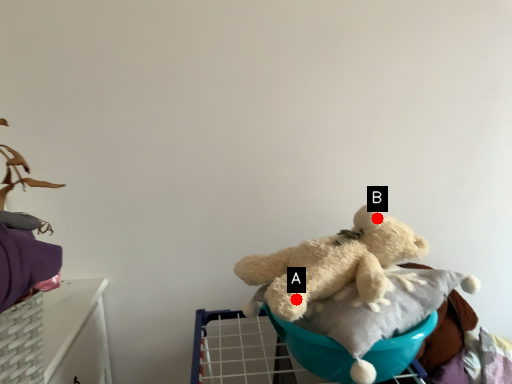
Question: Two points are circled on the image, labeled by A and B beside each circle. Which point is closer to the camera?

Choices:
 (A) A is closer
 (B) B is closer

Answer: (A)